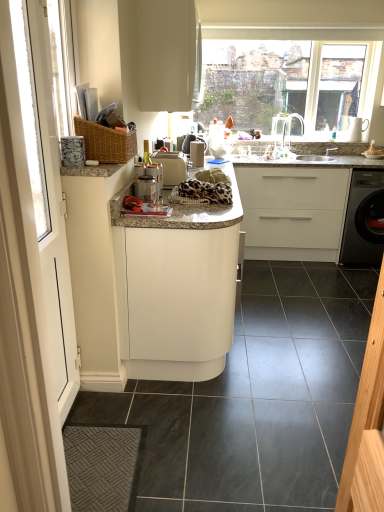
Question: Can you confirm if white matte cabinet at upper center, the third cabinetry ordered from the bottom, is smaller than white matte cabinet at center, the 1th cabinetry ordered from the bottom?

Choices:
 (A) yes
 (B) no

Answer: (A)

Question: Is the depth of white matte cabinet at upper center, the 1th cabinetry from the top, greater than that of white matte cabinet at center, marked as the 3th cabinetry in a top-to-bottom arrangement?

Choices:
 (A) no
 (B) yes

Answer: (B)

Question: Does white matte cabinet at upper center, the third cabinetry ordered from the bottom, have a lesser width compared to white matte cabinet at center, the 1th cabinetry ordered from the bottom?

Choices:
 (A) no
 (B) yes

Answer: (B)

Question: Is white matte cabinet at upper center, the 1th cabinetry from the top, far from white matte cabinet at center, the 1th cabinetry ordered from the bottom?

Choices:
 (A) yes
 (B) no

Answer: (A)

Question: From a real-world perspective, is white matte cabinet at upper center, the 1th cabinetry from the top, located higher than white matte cabinet at center, the 1th cabinetry ordered from the bottom?

Choices:
 (A) no
 (B) yes

Answer: (B)

Question: Is white matte cabinet at center, the 1th cabinetry ordered from the bottom, located within white matte cabinet at upper center, the 1th cabinetry from the top?

Choices:
 (A) no
 (B) yes

Answer: (A)

Question: Could you tell me if satin silver coffee machine at center is turned towards granite countertop at center?

Choices:
 (A) yes
 (B) no

Answer: (B)

Question: Is satin silver coffee machine at center positioned far away from granite countertop at center?

Choices:
 (A) no
 (B) yes

Answer: (B)

Question: Does satin silver coffee machine at center have a lesser height compared to granite countertop at center?

Choices:
 (A) yes
 (B) no

Answer: (A)

Question: Is satin silver coffee machine at center facing away from granite countertop at center?

Choices:
 (A) no
 (B) yes

Answer: (A)

Question: Is satin silver coffee machine at center positioned behind granite countertop at center?

Choices:
 (A) yes
 (B) no

Answer: (A)

Question: From the image's perspective, would you say satin silver coffee machine at center is shown under granite countertop at center?

Choices:
 (A) yes
 (B) no

Answer: (B)

Question: Is white glossy screen door at left bigger than white matte cabinet at center, marked as the 2th cabinetry in a top-to-bottom arrangement?

Choices:
 (A) yes
 (B) no

Answer: (B)